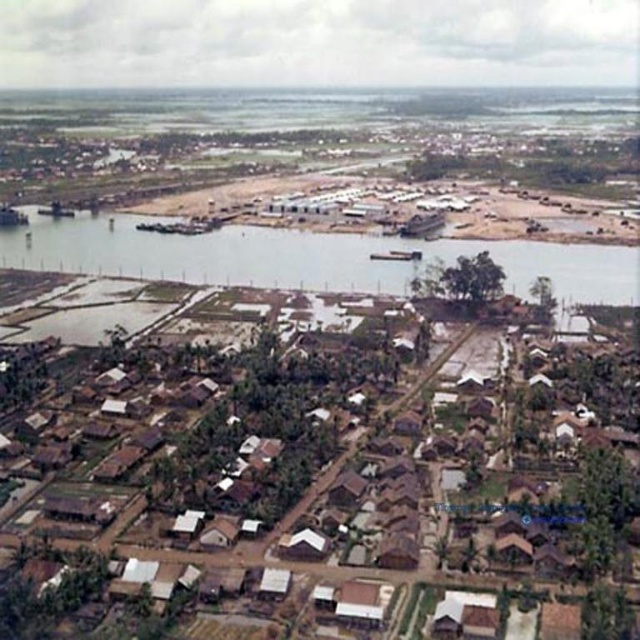
The width and height of the screenshot is (640, 640). What do you see at coordinates (321, 486) in the screenshot? I see `brown thatched-roof houses at lower left` at bounding box center [321, 486].

How distant is brown thatched-roof houses at lower left from brown earthy river at center?

418.21 feet

Which is behind, point (129, 628) or point (268, 243)?

Point (268, 243)

Locate an element on the screen. Image resolution: width=640 pixels, height=640 pixels. brown thatched-roof houses at lower left is located at coordinates (321, 486).